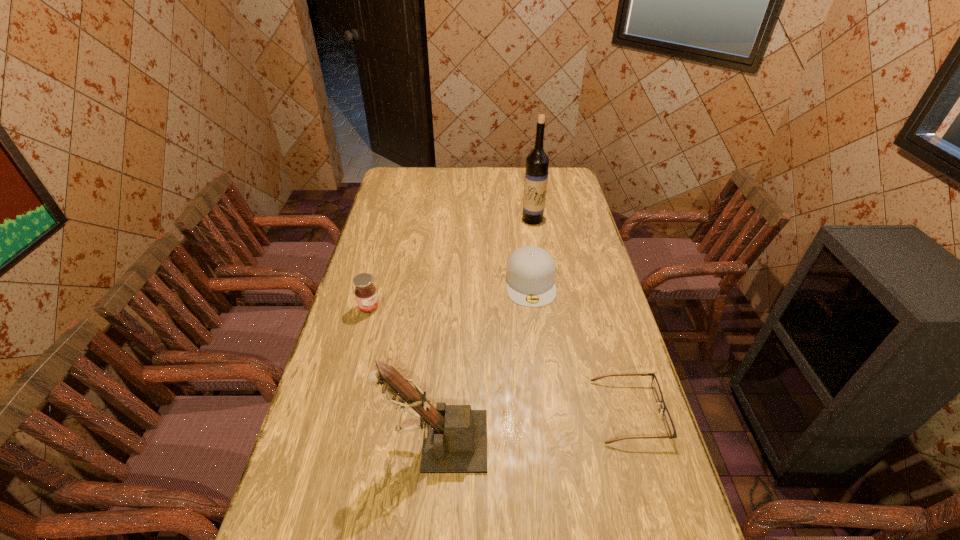
The height and width of the screenshot is (540, 960). I want to click on vacant area situated 0.200m on the front-facing side of the fourth object from right to left, so click(x=306, y=441).

The height and width of the screenshot is (540, 960). Identify the location of free space located 0.160m on the label side of the third tallest object. (407, 336).

You are a GUI agent. You are given a task and a screenshot of the screen. Output one action in this format:
    pyautogui.click(x=<x>, y=<y>)
    Task: Click on the vacant space located on the label side of the third tallest object
    Image resolution: width=960 pixels, height=540 pixels.
    Given the screenshot: What is the action you would take?
    pyautogui.click(x=432, y=356)

Image resolution: width=960 pixels, height=540 pixels. In order to click on free region located 0.080m on the label side of the third tallest object in this screenshot , I will do `click(391, 325)`.

Locate an element on the screen. The width and height of the screenshot is (960, 540). vacant space located on the label of the wine bottle is located at coordinates (533, 236).

Where is `free space located 0.100m on the label of the wine bottle`? This screenshot has height=540, width=960. free space located 0.100m on the label of the wine bottle is located at coordinates (533, 239).

This screenshot has height=540, width=960. Identify the location of vacant space located 0.140m on the label of the wine bottle. (533, 245).

I want to click on vacant region located on the front-facing side of the fourth tallest object, so click(x=538, y=358).

Where is `free space located 0.050m on the front-facing side of the fourth tallest object`? This screenshot has width=960, height=540. free space located 0.050m on the front-facing side of the fourth tallest object is located at coordinates (534, 318).

This screenshot has height=540, width=960. I want to click on free spot located on the front-facing side of the fourth tallest object, so click(536, 332).